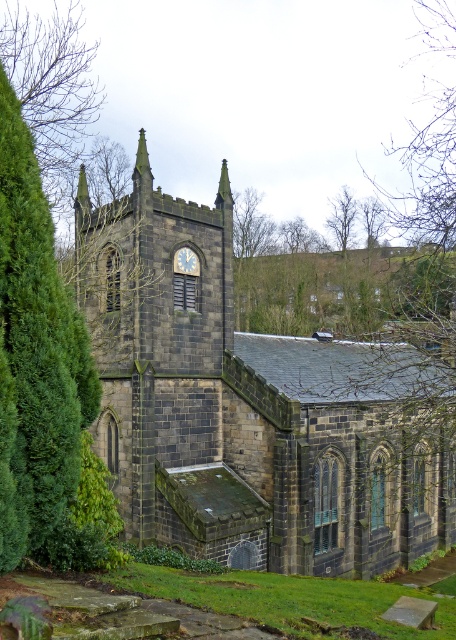
You are standing in front of the historic stone church and notice two trees at the upper center of the scene. If you want to place a bench exactly halfway between the brown textured tree at upper center and the green leafy tree at upper center, how far apart should the bench be placed from each tree?

The bench should be placed 1.06 meters away from each tree since the distance between the brown textured tree at upper center and the green leafy tree at upper center is 2.12 meters, so half of that distance is 1.06 meters.

You are standing in front of the historic stone church and notice a brown wood tree at upper center and a blue stone clock at center. Which object is positioned to the right of the other?

The brown wood tree at upper center is positioned to the right of the blue stone clock at center.

You are standing in front of the historic stone church and notice a green leafy tree at center and a blue stone clock at center. Which object is closer to you?

The green leafy tree at center is closer to you because it is in front of the blue stone clock at center.